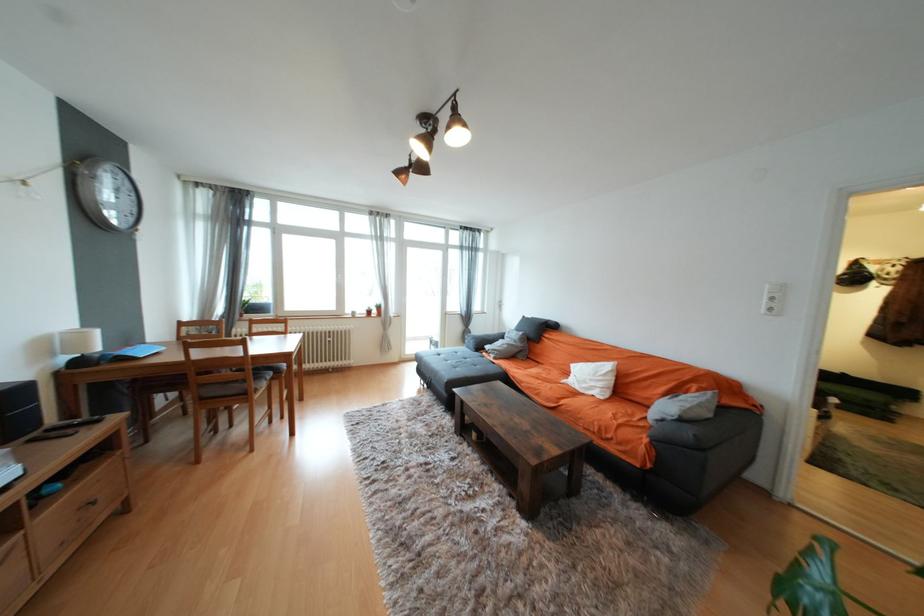
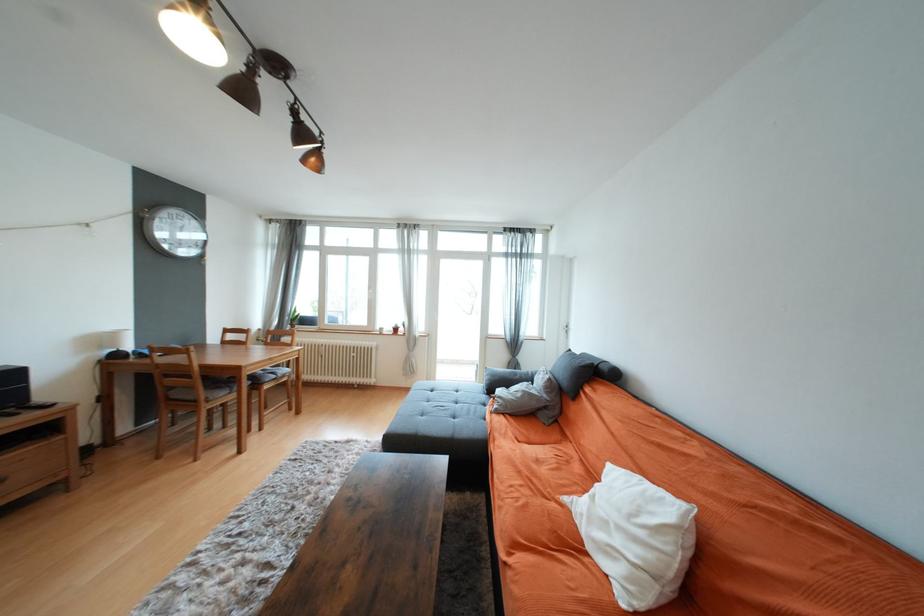
Where in the second image is the point corresponding to pixel 502 360 from the first image?

(503, 413)